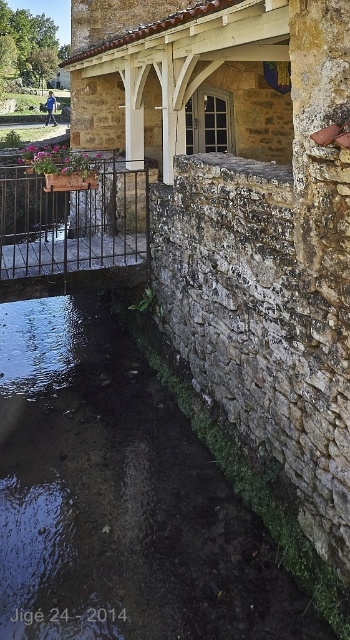
You are standing at the center of the image and want to walk towards the metal railing on the left. There is a point marked at coordinates (124, 497). What object is located at this point?

The point at coordinates (124, 497) corresponds to the dark stone river at lower left.

You are standing on the paved area near the metallic black railing at center. You want to cross to the other side of the dark stone river at lower left. Is the railing in your path to the river?

The dark stone river at lower left is located below the metallic black railing at center, so the railing is blocking your path to the river.

You are standing at the camera position and want to cross to the other side of the dark stone river at lower left. If your average walking speed is 1.5 meters per second, how many seconds will it take you to reach the opposite bank?

The distance between the camera and the dark stone river at lower left is 3.89 meters. At a walking speed of 1.5 meters per second, it would take approximately 2.6 seconds to cross the river.